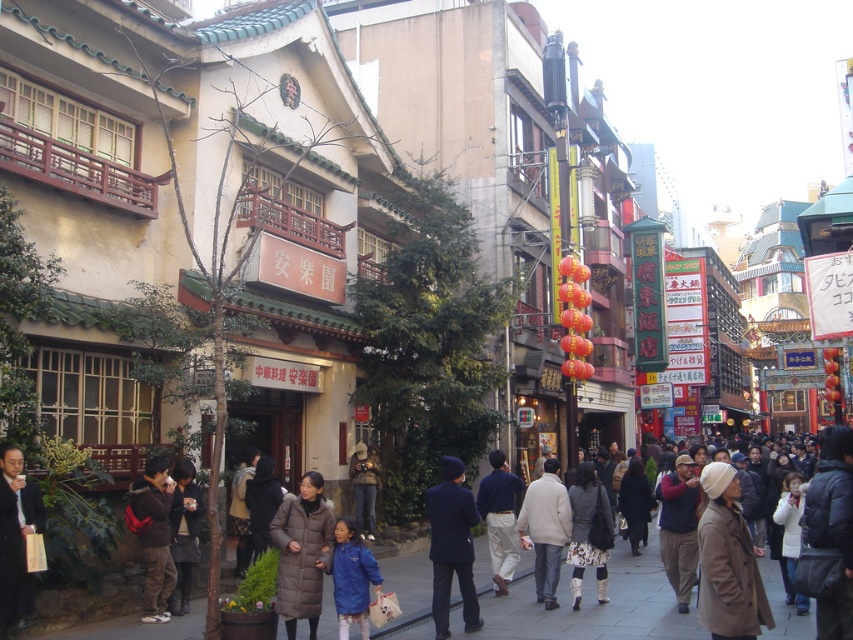
You are a delivery person who needs to navigate through the crowd in the bustling Chinatown street scene. You are currently standing near the brown woolen coat at lower right and need to reach the matte gray coat at center. Considering the crowd density, which direction should you move to get closer to your destination?

To reach the matte gray coat at center from the brown woolen coat at lower right, you should move towards the center of the street since the distance between them is 51.34 feet, indicating they are not adjacent and the center direction would logically lead towards the central coat.